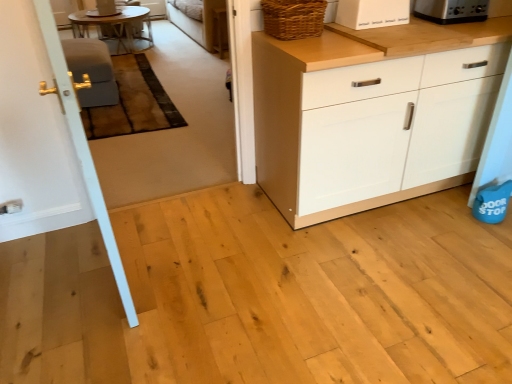
Where is `vacant space behind white painted wood door at left`? vacant space behind white painted wood door at left is located at coordinates (157, 223).